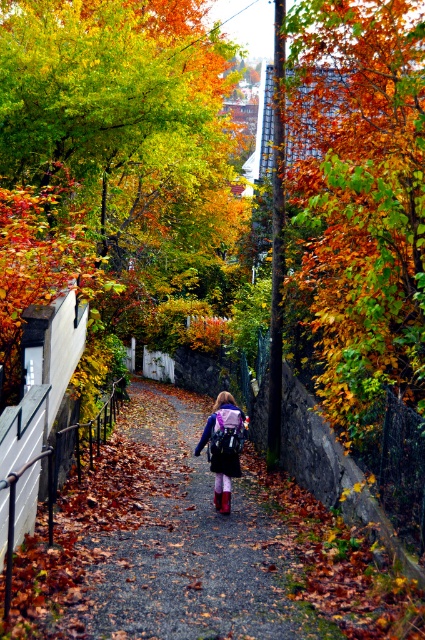
Question: Which is farther from the shiny orange leaves at upper center?

Choices:
 (A) autumn leaves at upper right
 (B) gravel path at center
 (C) matte purple backpack at center

Answer: (C)

Question: Does autumn leaves at upper right have a smaller size compared to matte purple backpack at center?

Choices:
 (A) yes
 (B) no

Answer: (B)

Question: Does shiny orange leaves at upper center appear on the left side of matte purple backpack at center?

Choices:
 (A) yes
 (B) no

Answer: (A)

Question: Which point is farther from the camera taking this photo?

Choices:
 (A) (176, 150)
 (B) (237, 436)
 (C) (410, 65)
 (D) (249, 584)

Answer: (A)

Question: Which of the following is the closest to the observer?

Choices:
 (A) matte purple backpack at center
 (B) gravel path at center
 (C) autumn leaves at upper right
 (D) shiny orange leaves at upper center

Answer: (B)

Question: Does autumn leaves at upper right come in front of shiny orange leaves at upper center?

Choices:
 (A) yes
 (B) no

Answer: (A)